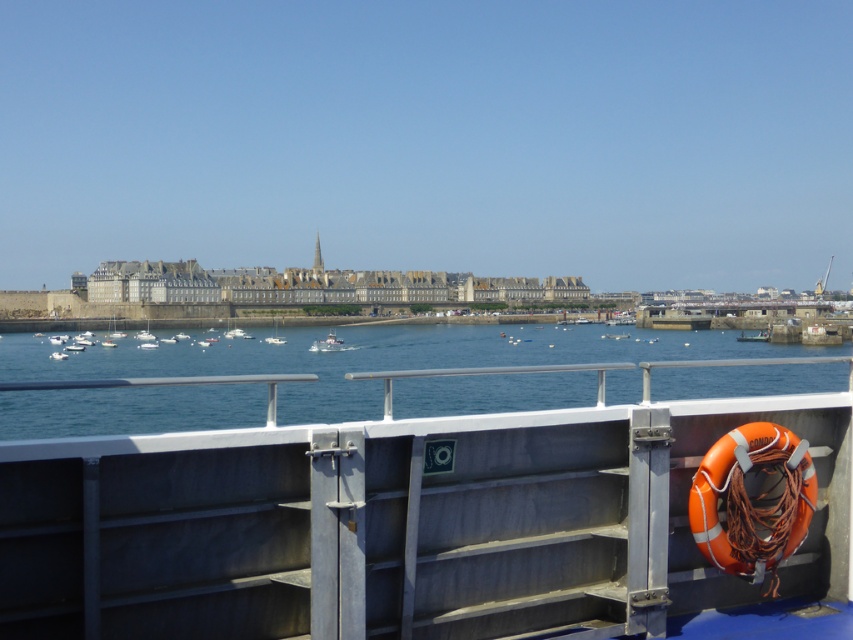
Who is more distant from viewer, (846, 540) or (100, 412)?

The point (100, 412) is behind.

Does point (71, 547) come closer to viewer compared to point (213, 387)?

Yes, it is.

This screenshot has width=853, height=640. Describe the element at coordinates (399, 524) in the screenshot. I see `metallic gray deck at center` at that location.

Find the location of `metallic gray deck at center`. metallic gray deck at center is located at coordinates (399, 524).

Between blue water at center and white plastic boat at center, which one has less height?

white plastic boat at center

Is blue water at center shorter than white plastic boat at center?

In fact, blue water at center may be taller than white plastic boat at center.

Consider the image. Measure the distance between blue water at center and camera.

blue water at center and camera are 11.40 meters apart from each other.

This screenshot has height=640, width=853. I want to click on blue water at center, so click(x=373, y=356).

Is blue water at center further to camera compared to orange rubber boat at center?

No, blue water at center is closer to the viewer.

Which is below, blue water at center or orange rubber boat at center?

blue water at center is below.

Image resolution: width=853 pixels, height=640 pixels. What do you see at coordinates (373, 356) in the screenshot?
I see `blue water at center` at bounding box center [373, 356].

I want to click on blue water at center, so click(373, 356).